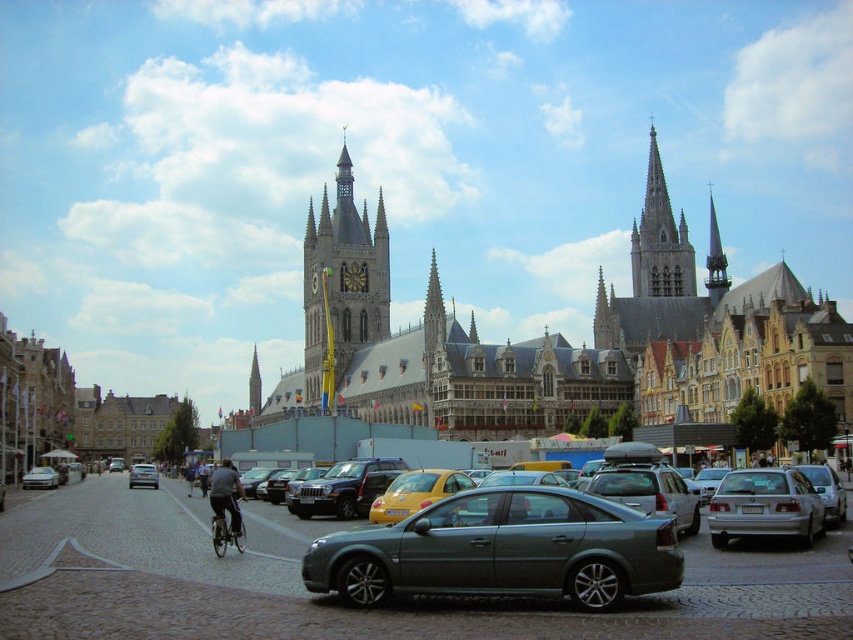
Is silver metallic bicycle at center shorter than matte silver sedan at center?

Indeed, silver metallic bicycle at center has a lesser height compared to matte silver sedan at center.

From the picture: Who is more distant from viewer, (219, 532) or (154, 470)?

The point (154, 470) is more distant.

You are a GUI agent. You are given a task and a screenshot of the screen. Output one action in this format:
    pyautogui.click(x=<x>, y=<y>)
    Task: Click on the silver metallic bicycle at center
    The image size is (853, 640).
    Given the screenshot: What is the action you would take?
    pyautogui.click(x=227, y=531)

Measure the distance between silver metallic sedan at right and silver metallic sedan at lower left.

A distance of 78.07 meters exists between silver metallic sedan at right and silver metallic sedan at lower left.

Does point (732, 536) come farther from viewer compared to point (57, 474)?

No.

The image size is (853, 640). Describe the element at coordinates (764, 506) in the screenshot. I see `silver metallic sedan at right` at that location.

Find the location of a particular element. This screenshot has height=640, width=853. silver metallic sedan at right is located at coordinates (764, 506).

Which is behind, point (614, 547) or point (712, 531)?

The point (712, 531) is behind.

The width and height of the screenshot is (853, 640). Describe the element at coordinates (502, 550) in the screenshot. I see `satin gray sedan at center` at that location.

Describe the element at coordinates (502, 550) in the screenshot. This screenshot has height=640, width=853. I see `satin gray sedan at center` at that location.

I want to click on satin gray sedan at center, so coord(502,550).